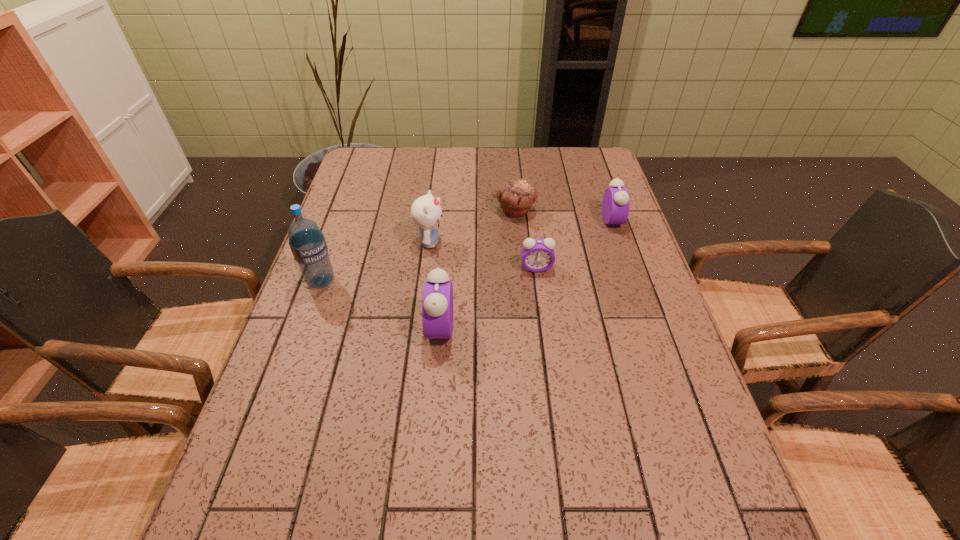
Considering the uniform spacing of alarm clocks, where should an additional alarm clock be positioned on the left? Please locate a free spot. Please provide its 2D coordinates. Your answer should be formatted as a tuple, i.e. [(x, y)], where the tuple contains the x and y coordinates of a point satisfying the conditions above.

[(313, 407)]